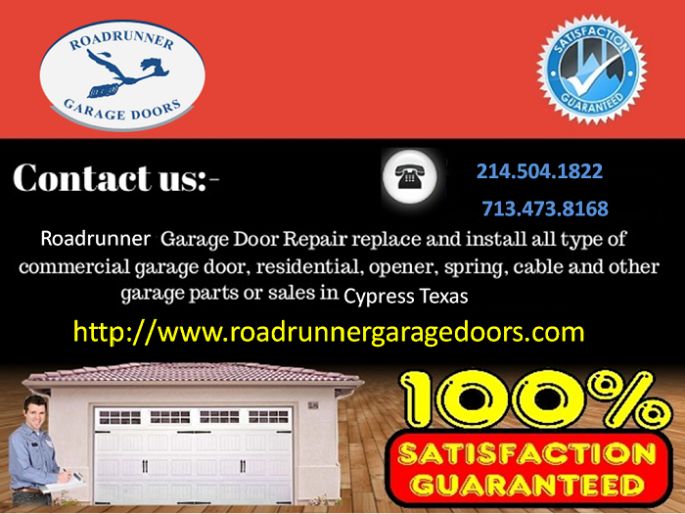
The image size is (685, 514). Find the location of `hardwood floor`. hardwood floor is located at coordinates (369, 428).